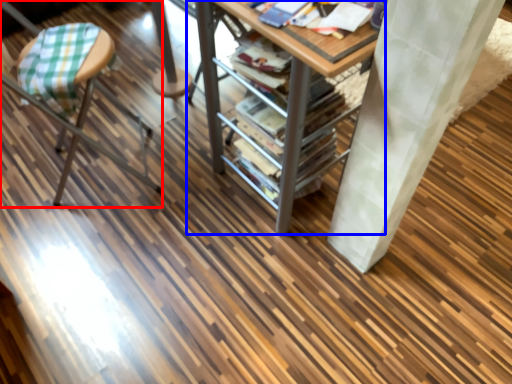
Question: Which point is closer to the camera, furniture (highlighted by a red box) or table (highlighted by a blue box)?

Choices:
 (A) furniture
 (B) table

Answer: (B)